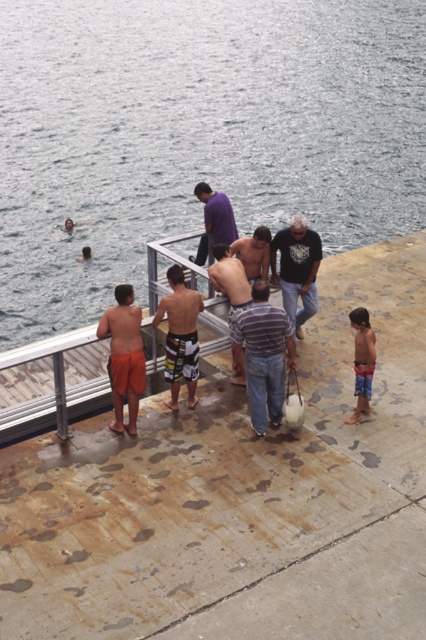
You are standing at point (249, 288) and want to walk to the edge of the dock. Is the point (154, 323) closer to the edge than you are?

Yes, point (154, 323) is closer to the edge of the dock because it is in front of point (249, 288).

You are a photographer trying to capture a photo of the dark gray cotton shirt at center and the blue striped shorts at lower right. Which object should you focus on first if you want to ensure both are in focus, considering their heights?

The dark gray cotton shirt at center is taller than blue striped shorts at lower right, so you should focus on the dark gray cotton shirt at center first to ensure both are in focus.

You are a photographer trying to capture a photo of the rusty concrete dock at center and the purple matte shirt at center. Which object should you focus on first if you want to ensure both are in the frame without moving the camera?

The rusty concrete dock at center is not as tall as the purple matte shirt at center, so you should focus on the purple matte shirt at center first to ensure both are in the frame.